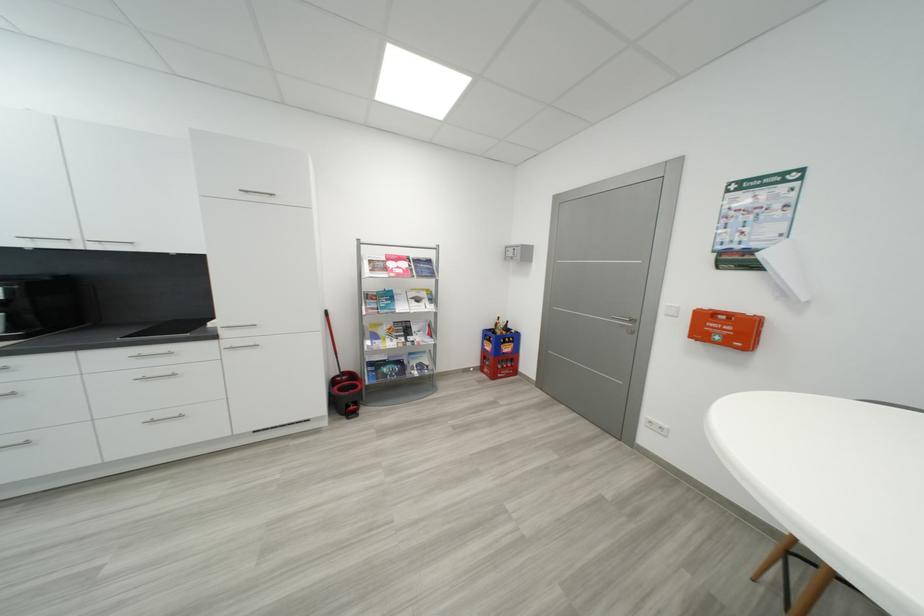
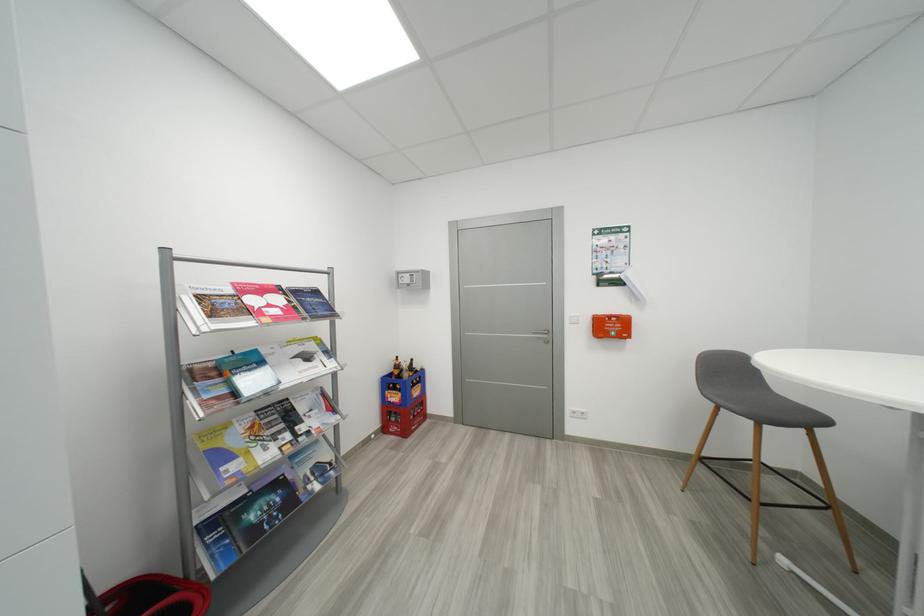
The point at (409,341) is marked in the first image. Where is the corresponding point in the second image?

(294, 438)